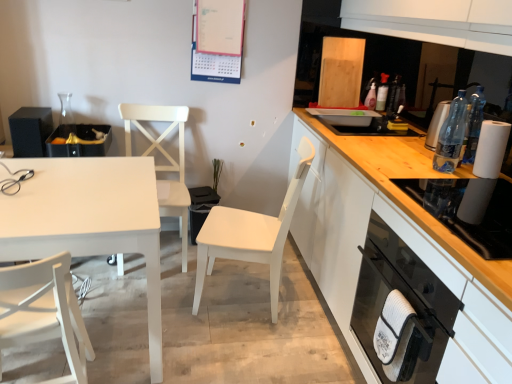
Question: Which is correct: black matte speaker at left, which ranks as the 1th appliance in left-to-right order, is inside translucent plastic bottle at upper right, the second bottle positioned from the front, or outside of it?

Choices:
 (A) inside
 (B) outside

Answer: (B)

Question: From the image's perspective, is black matte speaker at left, which ranks as the 3th appliance in right-to-left order, positioned above or below translucent plastic bottle at upper right, positioned as the first bottle in back-to-front order?

Choices:
 (A) below
 (B) above

Answer: (A)

Question: Estimate the real-world distances between objects in this image. Which object is closer to the black glass oven at lower right?

Choices:
 (A) white matte table at left
 (B) matte paperboard calendar at upper center
 (C) matte black trash bin at left, acting as the 2th appliance starting from the left
 (D) white matte chair at lower left, placed as the first chair when sorted from front to back
 (E) white matte chair at center, the second chair positioned from the back

Answer: (E)

Question: Based on their relative distances, which object is nearer to the white matte chair at center, which ranks as the 3th chair in front-to-back order?

Choices:
 (A) black glass oven at lower right
 (B) translucent plastic bottle at upper right, the 1th bottle in the top-to-bottom sequence
 (C) black matte speaker at left, which ranks as the 3th appliance in right-to-left order
 (D) clear glass water bottles at right, which ranks as the first appliance in front-to-back order
 (E) white matte table at left

Answer: (C)